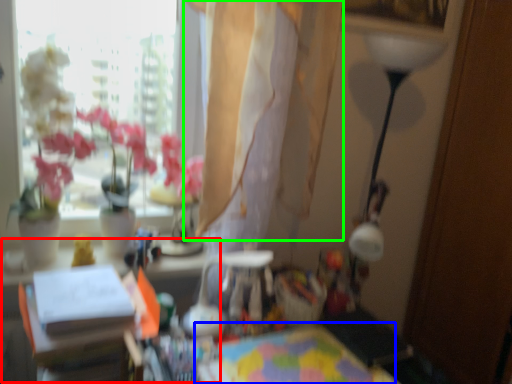
Question: Which is farther away from table (highlighted by a red box)? table (highlighted by a blue box) or curtain (highlighted by a green box)?

Choices:
 (A) table
 (B) curtain

Answer: (B)